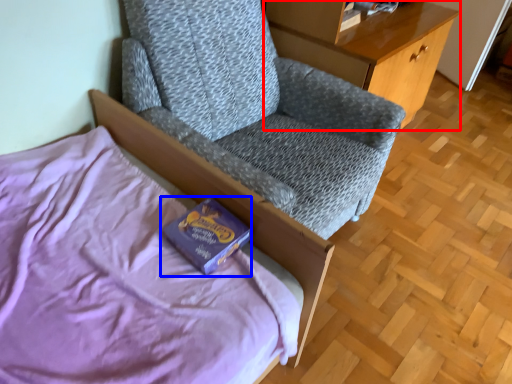
Question: Which object is further to the camera taking this photo, desk (highlighted by a red box) or paperback book (highlighted by a blue box)?

Choices:
 (A) desk
 (B) paperback book

Answer: (A)